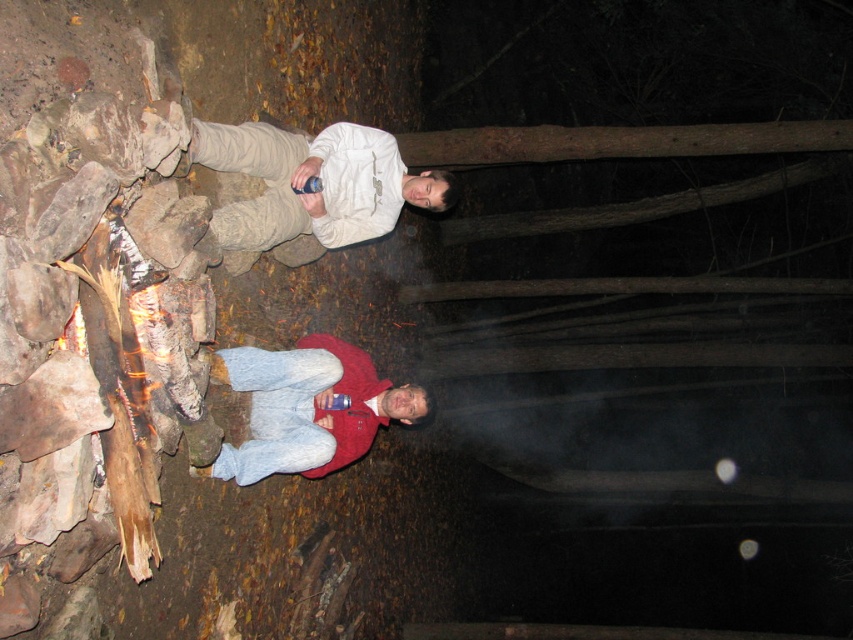
Question: Can you confirm if white matte shirt at upper center is positioned to the right of red fleece jacket at center?

Choices:
 (A) no
 (B) yes

Answer: (A)

Question: Which point is farther to the camera?

Choices:
 (A) (328, 419)
 (B) (268, 228)

Answer: (A)

Question: From the image, what is the correct spatial relationship of white matte shirt at upper center in relation to red fleece jacket at center?

Choices:
 (A) right
 (B) left

Answer: (B)

Question: Is white matte shirt at upper center to the right of red fleece jacket at center from the viewer's perspective?

Choices:
 (A) yes
 (B) no

Answer: (B)

Question: Which point is closer to the camera?

Choices:
 (A) white matte shirt at upper center
 (B) red fleece jacket at center

Answer: (A)